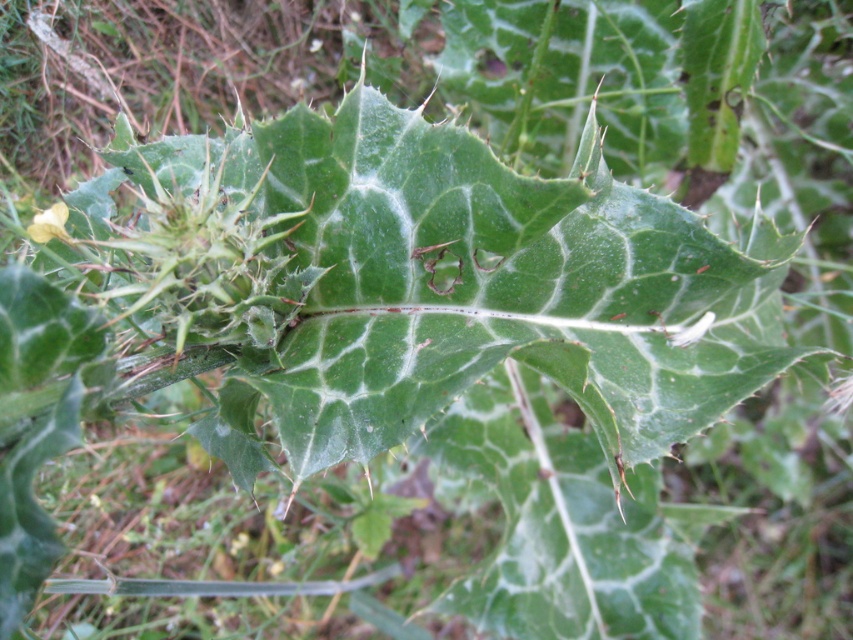
Question: Does green matte leaf at center appear under yellow matte flower at upper left?

Choices:
 (A) no
 (B) yes

Answer: (B)

Question: Is green matte leaf at center wider than yellow matte flower at upper left?

Choices:
 (A) yes
 (B) no

Answer: (A)

Question: Can you confirm if green matte leaf at center is positioned below yellow matte flower at upper left?

Choices:
 (A) yes
 (B) no

Answer: (A)

Question: Which point is farther from the camera taking this photo?

Choices:
 (A) pos(61,227)
 (B) pos(671,275)

Answer: (B)

Question: Which of the following is the closest to the observer?

Choices:
 (A) (412, 380)
 (B) (64, 230)

Answer: (A)